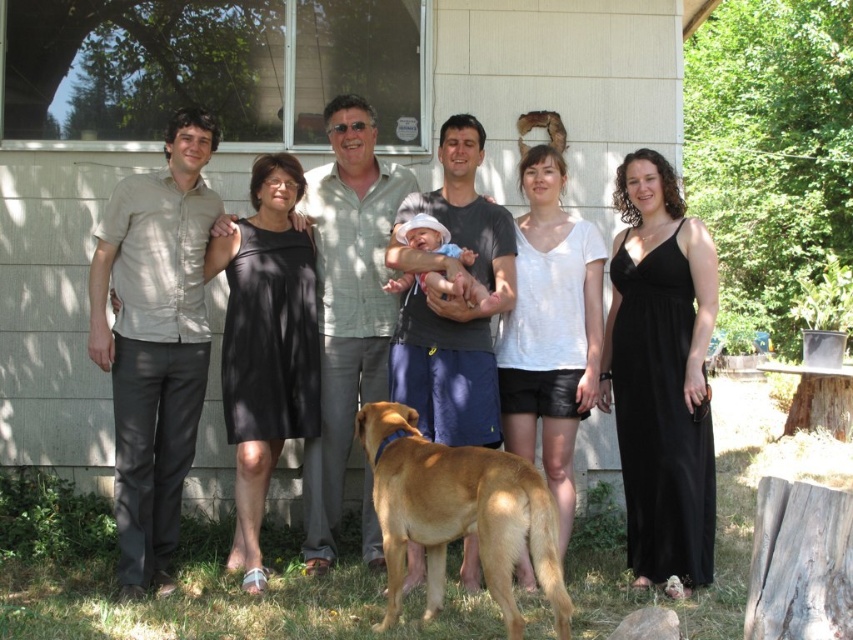
You are a photographer trying to adjust the lighting for a photo shoot. You notice the matte black dress at center and the soft pink fabric baby at center. Which object is positioned higher in the image?

The matte black dress at center is positioned higher than the soft pink fabric baby at center because it is much taller as described.

You are standing 2 meters away from the golden fur dog at lower center. Can you reach the dog without moving closer?

The golden fur dog at lower center and viewer are 3.46 meters apart from each other, so you are actually 1.46 meters away from the dog. Since the distance is less than 2 meters, you can reach the dog without moving closer.

You are standing at the center of the image and want to locate the golden fur dog at lower center. According to the coordinates provided, in which direction should you move to find it?

The golden fur dog at lower center is located at coordinates point (x=459, y=513). Since you are at the center, moving to the right and slightly downward will lead you to the golden fur dog at lower center.